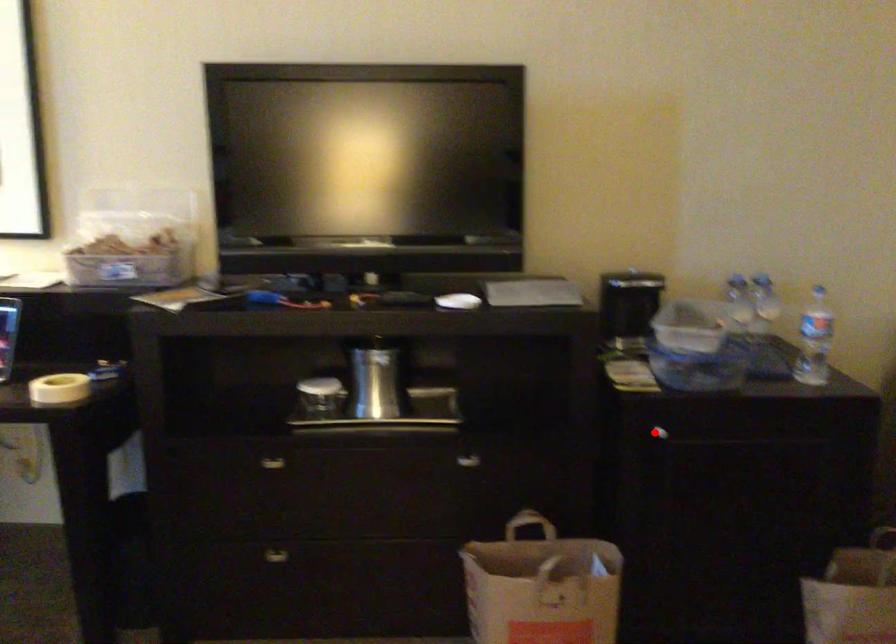
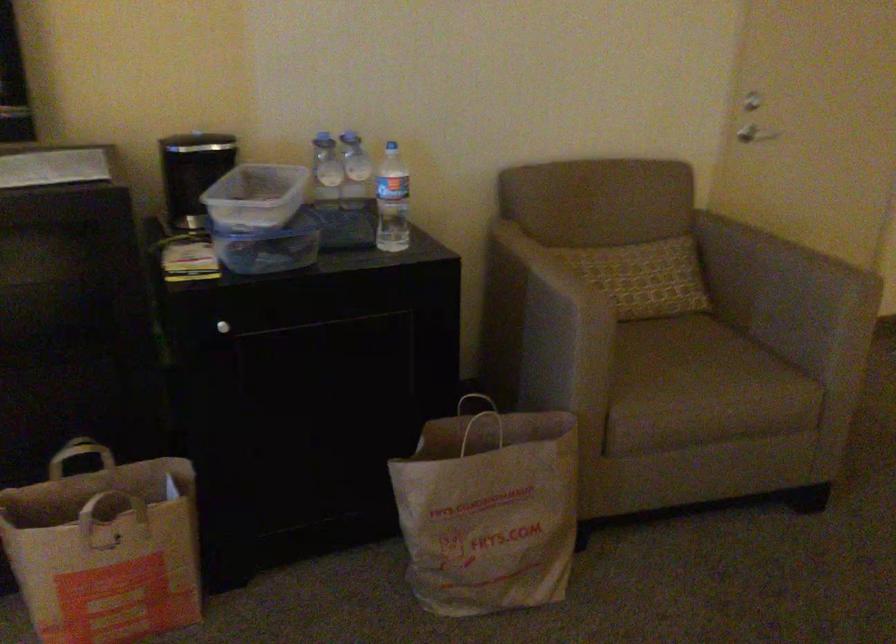
Find the pixel in the second image that matches the highlighted location in the first image.

(222, 327)